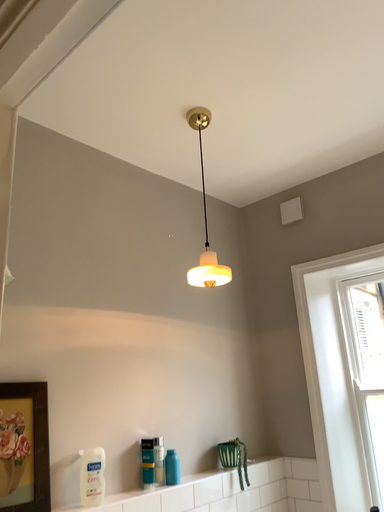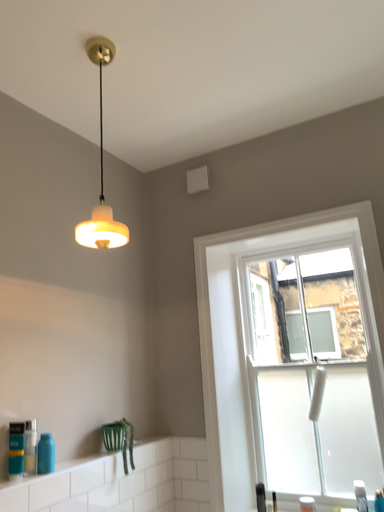
Question: How did the camera likely rotate when shooting the video?

Choices:
 (A) rotated left
 (B) rotated right

Answer: (B)